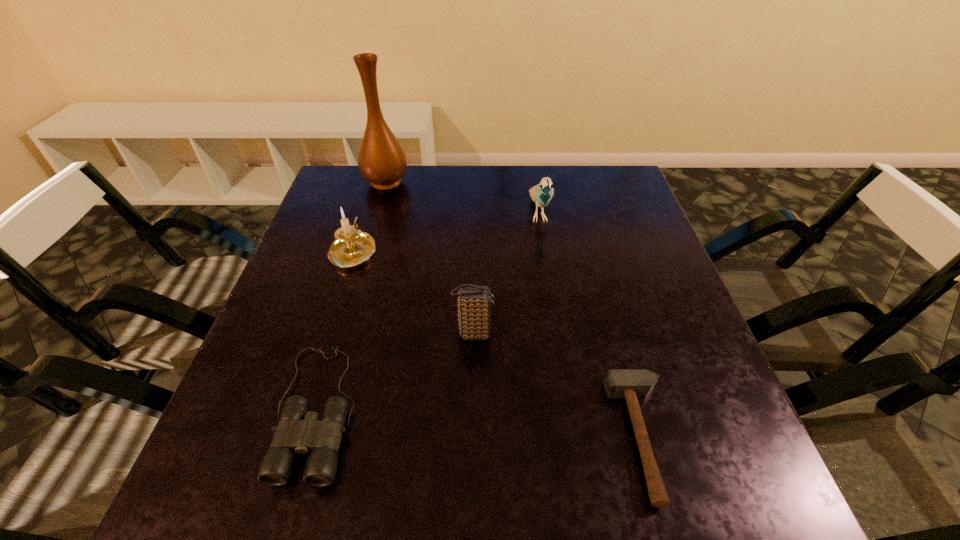
This screenshot has height=540, width=960. In order to click on hammer present at the near edge in this screenshot , I will do `click(630, 384)`.

Where is `vase that is at the left edge`? This screenshot has height=540, width=960. vase that is at the left edge is located at coordinates (382, 161).

The image size is (960, 540). Find the location of `candle holder at the left edge`. candle holder at the left edge is located at coordinates [352, 247].

You are a GUI agent. You are given a task and a screenshot of the screen. Output one action in this format:
    pyautogui.click(x=<x>, y=<y>)
    Task: Click on the binoculars present at the left edge
    Image resolution: width=960 pixels, height=540 pixels.
    Given the screenshot: What is the action you would take?
    pyautogui.click(x=298, y=431)

Where is `object that is at the right edge`? object that is at the right edge is located at coordinates (x=630, y=384).

Find the location of a particular element. This screenshot has width=960, height=540. object at the far left corner is located at coordinates (382, 161).

At what (x,y) coordinates should I click in order to perform the action: click on object located at the near left corner. Please return your answer as a coordinate pair (x, y). The height and width of the screenshot is (540, 960). Looking at the image, I should click on (298, 431).

Find the location of a particular element. The image size is (960, 540). object positioned at the near right corner is located at coordinates (630, 384).

The image size is (960, 540). In order to click on vacant space at the far edge of the desktop in this screenshot , I will do `click(493, 200)`.

In the image, there is a desktop. At what (x,y) coordinates should I click in order to perform the action: click on free space at the near edge. Please return your answer as a coordinate pair (x, y). This screenshot has width=960, height=540. Looking at the image, I should click on (463, 495).